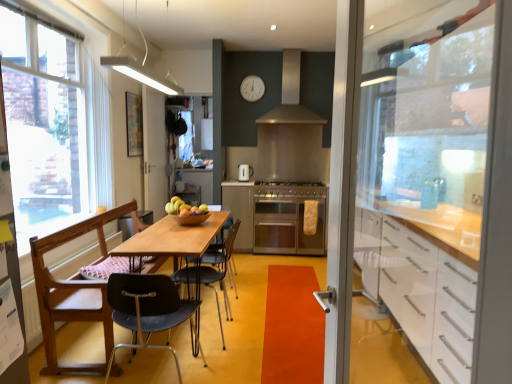
Identify the location of vacant area to the right of wooden chair at left, which is counted as the 2th chair, starting from the back. The image size is (512, 384). (270, 317).